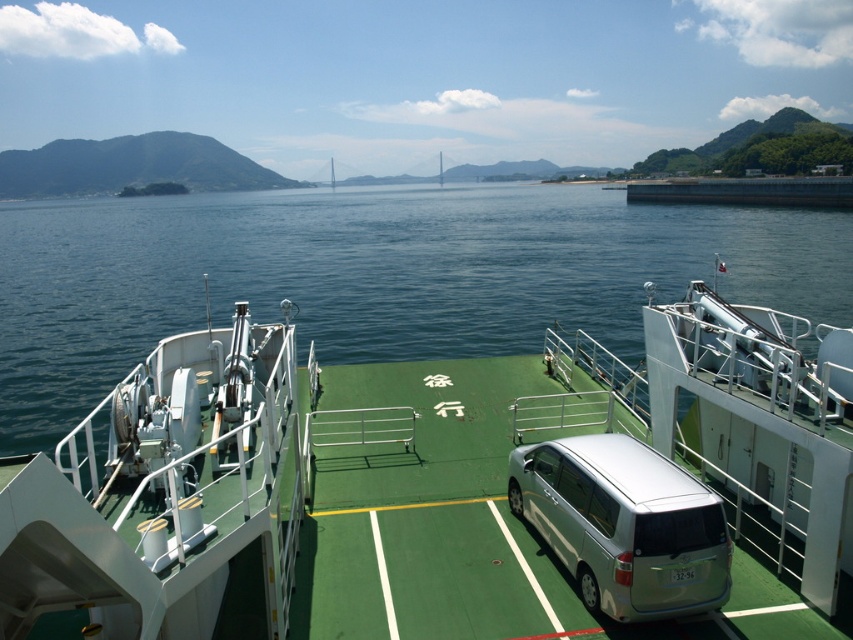
Is green rubber boat at center above silver metallic van at center?

Indeed, green rubber boat at center is positioned over silver metallic van at center.

Which is more to the left, green rubber boat at center or silver metallic van at center?

Positioned to the left is green rubber boat at center.

Between point (149, 522) and point (548, 513), which one is positioned behind?

Point (548, 513)

Find the location of a particular element. The image size is (853, 640). green rubber boat at center is located at coordinates (447, 490).

Is green rubber boat at center taller than green water at center?

Incorrect, green rubber boat at center's height is not larger of green water at center's.

Which is in front, point (387, 637) or point (67, 394)?

Point (387, 637)

Where is `green rubber boat at center`? green rubber boat at center is located at coordinates (447, 490).

Is green water at center positioned before silver metallic van at center?

No, it is not.

Based on the photo, who is more distant from viewer, (x=758, y=276) or (x=610, y=614)?

The point (x=758, y=276) is more distant.

Is point (384, 278) farther from viewer compared to point (714, 525)?

Yes, point (384, 278) is behind point (714, 525).

This screenshot has width=853, height=640. Identify the location of green water at center. (373, 276).